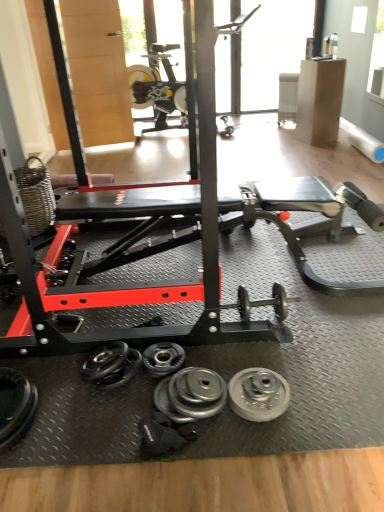
Where is `blank space to the left of silver metallic weight at center, which is the first wheel in left-to-right order`? blank space to the left of silver metallic weight at center, which is the first wheel in left-to-right order is located at coordinates (117, 424).